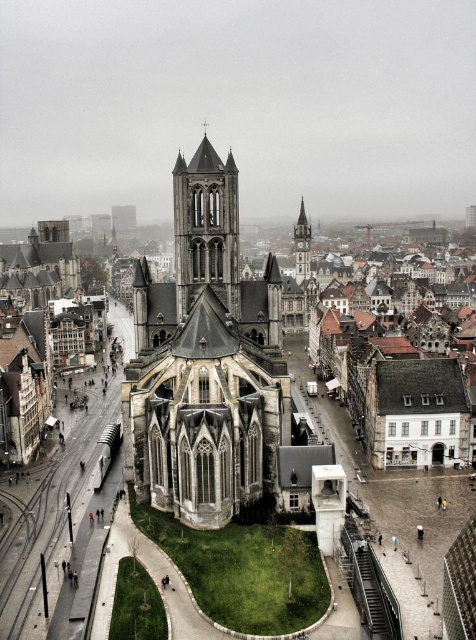
Which is below, smooth stone tower at center or smooth stone clock tower at center right?

smooth stone tower at center is lower down.

Can you confirm if smooth stone tower at center is shorter than smooth stone clock tower at center right?

Yes, smooth stone tower at center is shorter than smooth stone clock tower at center right.

Is point (216, 225) positioned in front of point (295, 227)?

Yes, it is in front of point (295, 227).

Image resolution: width=476 pixels, height=640 pixels. Identify the location of smooth stone tower at center. (206, 227).